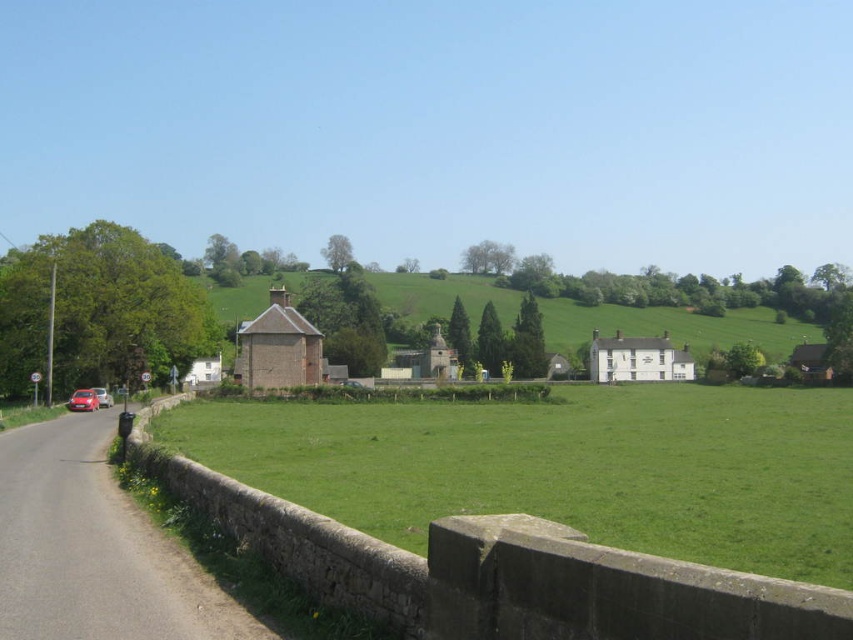
Question: Is green grass field at center bigger than green grassy hillside at center?

Choices:
 (A) no
 (B) yes

Answer: (A)

Question: Which point is closer to the camera?

Choices:
 (A) (674, 333)
 (B) (321, 432)
 (C) (105, 404)
 (D) (93, 404)

Answer: (B)

Question: Among these points, which one is farthest from the camera?

Choices:
 (A) pos(90,410)
 (B) pos(636,385)
 (C) pos(106,396)

Answer: (B)

Question: Can you confirm if green grass field at center is positioned to the right of matte silver car at left?

Choices:
 (A) no
 (B) yes

Answer: (B)

Question: Does green grass field at center appear on the left side of green grassy hillside at center?

Choices:
 (A) no
 (B) yes

Answer: (B)

Question: Which of the following is the farthest from the observer?

Choices:
 (A) (587, 448)
 (B) (86, 408)

Answer: (B)